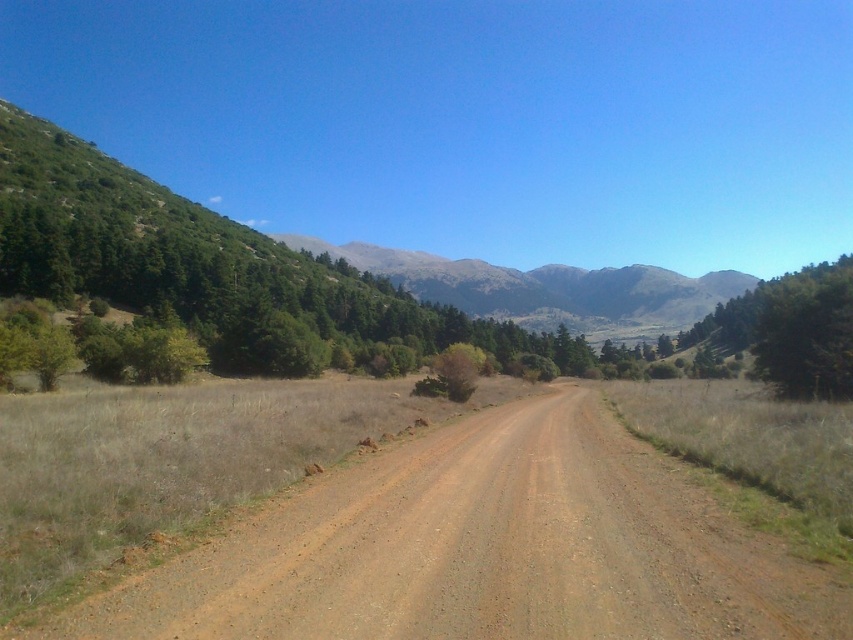
You are standing at the point with coordinates point (576, 269) and want to walk to the point with coordinates point (346, 516). Which direction should you face to walk towards the point?

You should face the direction towards point (346, 516), which is in front of point (576, 269).

Consider the image. You are standing at the point marked by point (x=483, y=548) on the brown gravel road at center. Looking ahead, which direction would you go to reach the mountains in the distance?

Since the brown gravel road at center is represented by point (x=483, y=548), following the road straight ahead would lead towards the mountains in the distance as described in the scene.